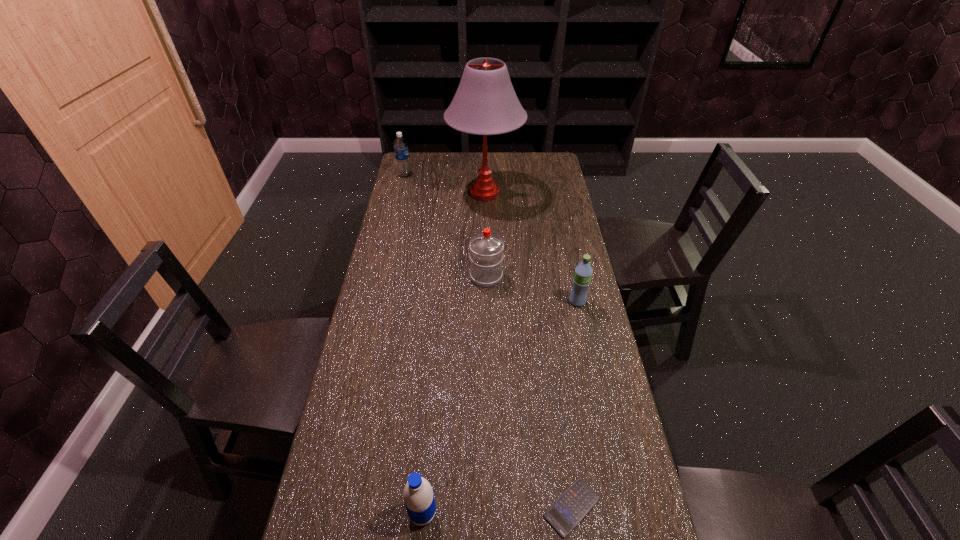
Choose which object is the fifth nearest neighbor to the second farthest water bottle. Please provide its 2D coordinates. Your answer should be formatted as a tuple, i.e. [(x, y)], where the tuple contains the x and y coordinates of a point satisfying the conditions above.

[(418, 495)]

Locate which water bottle ranks in proximity to the second water bottle from right to left. Please provide its 2D coordinates. Your answer should be formatted as a tuple, i.e. [(x, y)], where the tuple contains the x and y coordinates of a point satisfying the conditions above.

[(583, 272)]

Select which water bottle is the closest to the rightmost object. Please provide its 2D coordinates. Your answer should be formatted as a tuple, i.e. [(x, y)], where the tuple contains the x and y coordinates of a point satisfying the conditions above.

[(486, 256)]

This screenshot has width=960, height=540. Find the location of `vacant space that satisfies the following two spatial constraints: 1. on the back side of the rightmost object; 2. on the front-facing side of the tallest object`. vacant space that satisfies the following two spatial constraints: 1. on the back side of the rightmost object; 2. on the front-facing side of the tallest object is located at coordinates (554, 193).

Where is `free region that satisfies the following two spatial constraints: 1. on the back side of the third farthest water bottle; 2. on the left side of the shortest object`? The height and width of the screenshot is (540, 960). free region that satisfies the following two spatial constraints: 1. on the back side of the third farthest water bottle; 2. on the left side of the shortest object is located at coordinates (542, 301).